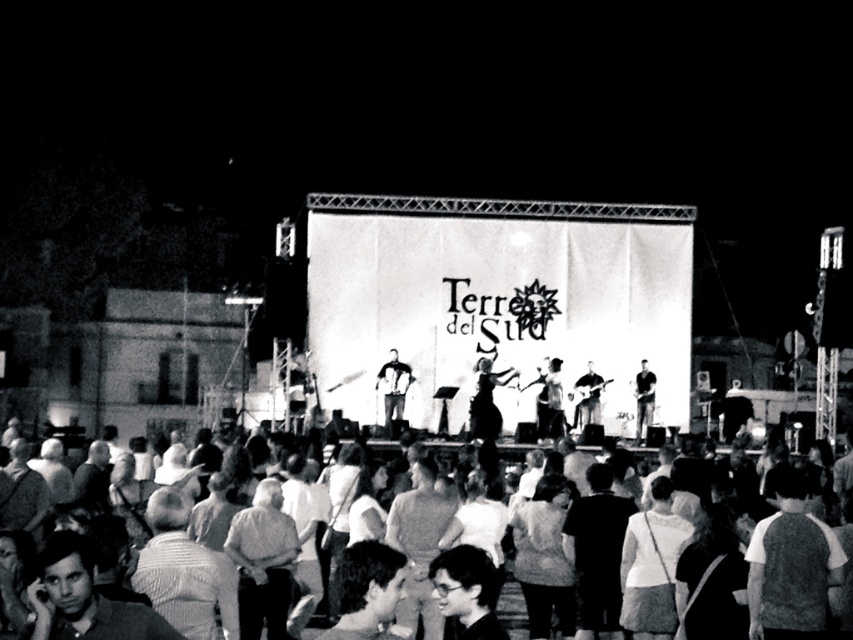
You are a photographer at the concert. You want to capture a photo of the smooth fabric dress at center. Where should you aim your camera to get the best shot?

The smooth fabric dress at center is located at coordinates point (486, 401), so you should aim your camera at that position to capture it best.

You are standing at the point marked as point (480, 374) in the concert venue. You want to take a photo of the stage with your camera. The camera requires a minimum distance of 100 meters to capture the entire stage in one shot. Can you take the photo from your current position?

The distance between point (480, 374) and the camera is 110.19 meters, which exceeds the minimum required distance of 100 meters. Therefore, you can take the photo from your current position to capture the entire stage in one shot.

You are a photographer at the concert and want to capture the smooth fabric dress at center in your shot. Given that your camera has a focal length of 50mm and the dress is at coordinates point (486, 401), can you confirm if the dress will be in the center of the frame?

Yes, the smooth fabric dress at center is located at point (486, 401), which corresponds to the center of the frame, so it will be centered in the shot.